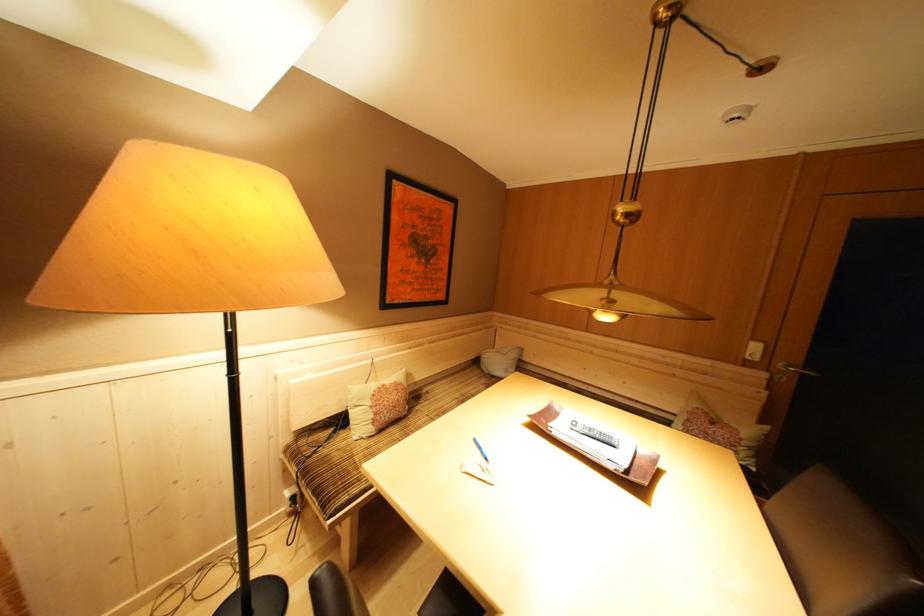
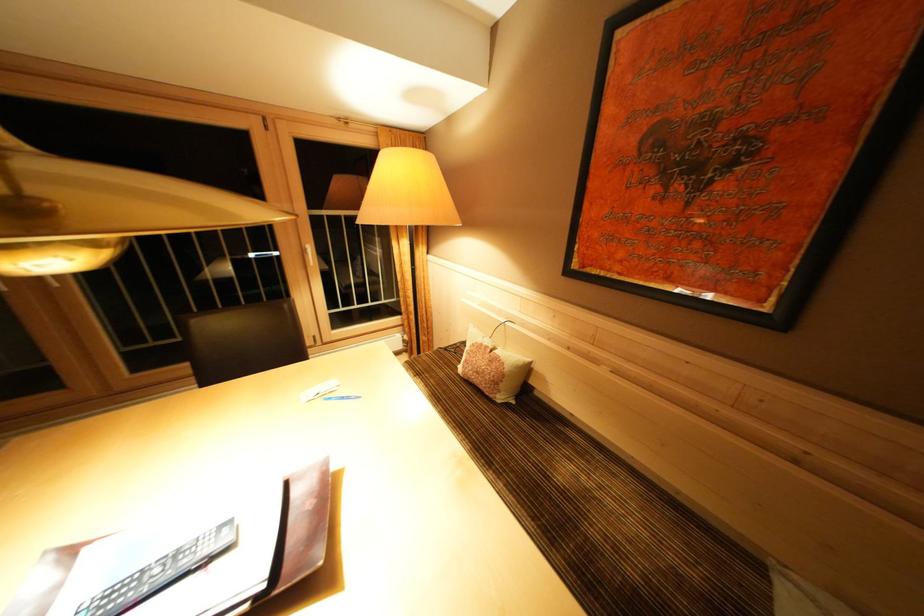
In the second image, find the point that corresponds to [434,398] in the first image.

(565, 438)